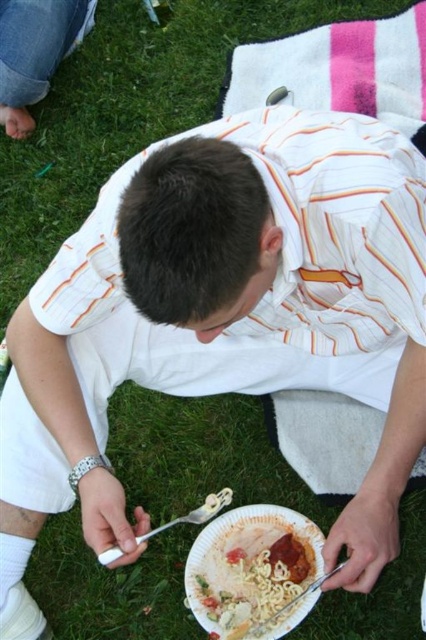
Question: Is jeans at upper left thinner than silver metallic fork at lower center?

Choices:
 (A) yes
 (B) no

Answer: (B)

Question: Which of the following is the closest to the observer?

Choices:
 (A) (114, 556)
 (B) (276, 589)

Answer: (A)

Question: Which point is farther to the camera?

Choices:
 (A) white paper plate at lower center
 (B) jeans at upper left
 (C) silver metallic fork at lower center

Answer: (B)

Question: Estimate the real-world distances between objects in this image. Which object is farther from the jeans at upper left?

Choices:
 (A) white paper plate at lower center
 (B) silver metallic fork at lower center

Answer: (A)

Question: From the image, what is the correct spatial relationship of white paper plate at lower center in relation to jeans at upper left?

Choices:
 (A) above
 (B) below

Answer: (B)

Question: From the image, what is the correct spatial relationship of jeans at upper left in relation to silver metallic fork at lower center?

Choices:
 (A) left
 (B) right

Answer: (A)